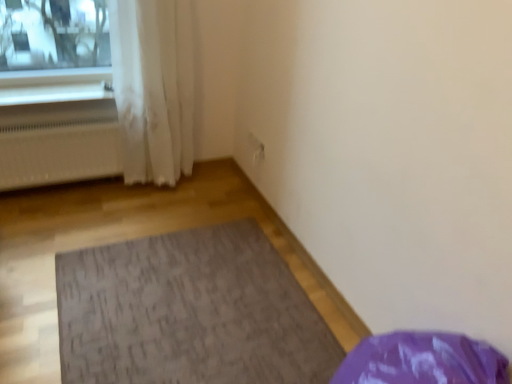
In order to click on free region under white sheer curtain at left (from a real-world perspective) in this screenshot , I will do `click(151, 185)`.